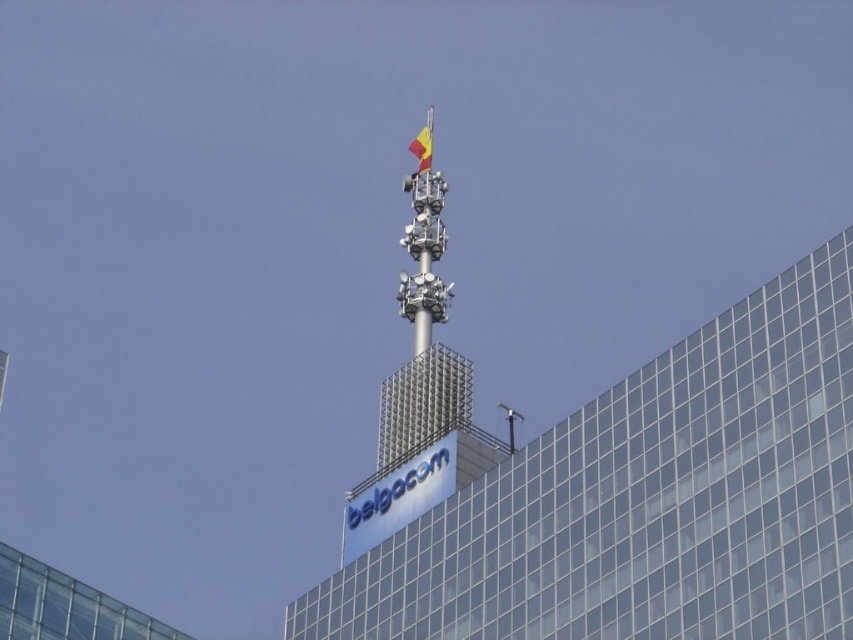
Question: Is metallic grid spire at upper center behind yellow fabric flag at upper center?

Choices:
 (A) no
 (B) yes

Answer: (A)

Question: Can you confirm if metallic grid spire at upper center is positioned to the right of yellow fabric flag at upper center?

Choices:
 (A) yes
 (B) no

Answer: (A)

Question: Which of the following is the closest to the observer?

Choices:
 (A) yellow fabric flag at upper center
 (B) metallic grid spire at upper center

Answer: (B)

Question: Which of the following is the farthest from the observer?

Choices:
 (A) (442, 390)
 (B) (424, 157)

Answer: (B)

Question: Is metallic grid spire at upper center above yellow fabric flag at upper center?

Choices:
 (A) yes
 (B) no

Answer: (B)